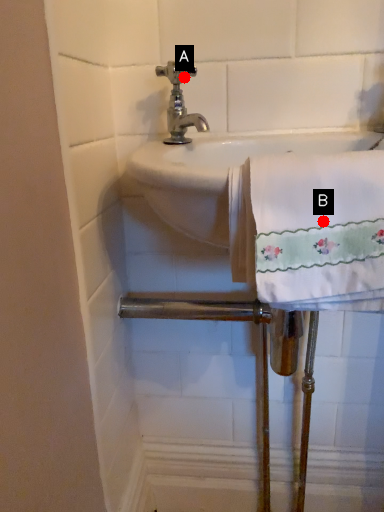
Question: Two points are circled on the image, labeled by A and B beside each circle. Among these points, which one is nearest to the camera?

Choices:
 (A) A is closer
 (B) B is closer

Answer: (B)